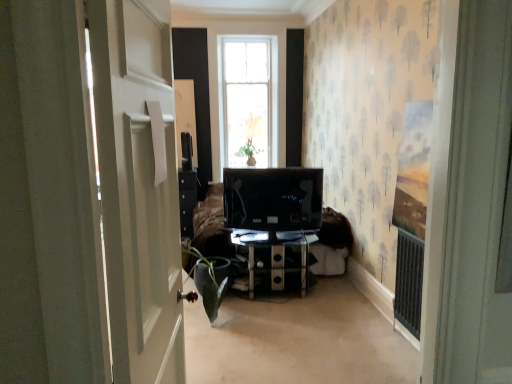
Question: Looking at their shapes, would you say green matte plant at lower left is wider or thinner than white glossy door at left?

Choices:
 (A) thin
 (B) wide

Answer: (B)

Question: In the image, is green matte plant at lower left on the left side or the right side of white glossy door at left?

Choices:
 (A) left
 (B) right

Answer: (A)

Question: Which of these objects is positioned farthest from the transparent glass tv stand at center?

Choices:
 (A) white glossy door at left
 (B) matte black monitor at center
 (C) green matte plant at lower left

Answer: (A)

Question: Which is nearer to the transparent glass tv stand at center?

Choices:
 (A) green matte plant at lower left
 (B) white glossy door at left
 (C) matte black monitor at center

Answer: (C)